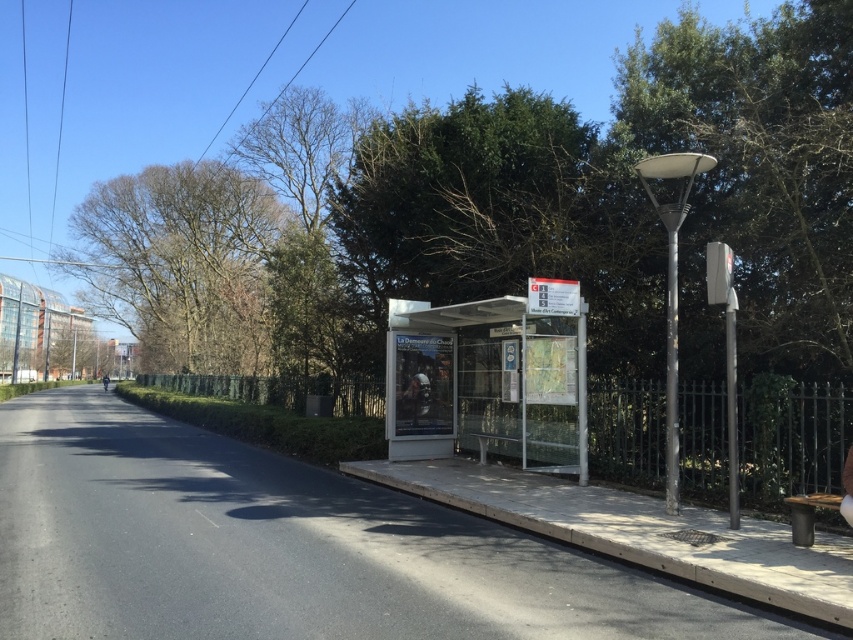
You are a pedestrian waiting at the metallic silver bus stop at center and want to sit down. There is a dark brown wooden bench at lower right nearby. Which direction should you move to reach the bench?

The metallic silver bus stop at center is positioned on the left side of dark brown wooden bench at lower right, so you should move to your right to reach the bench.

You are a delivery drone flying above the city. You need to land at the metallic silver bus stop at center. What are the coordinates where you should land?

The coordinates for the metallic silver bus stop at center are at point (490, 378).

You are a delivery robot with a height of 1.5 meters. You are positioned at the camera location and need to reach the concrete pavement at center. Is there enough space for you to move there without hitting your head?

The distance between the camera and the concrete pavement at center is 4.76 meters. Since the robot is 1.5 meters tall, there is sufficient vertical clearance as the height is not mentioned in the description. The horizontal distance is 4.76 meters, so the robot can move there without issue.